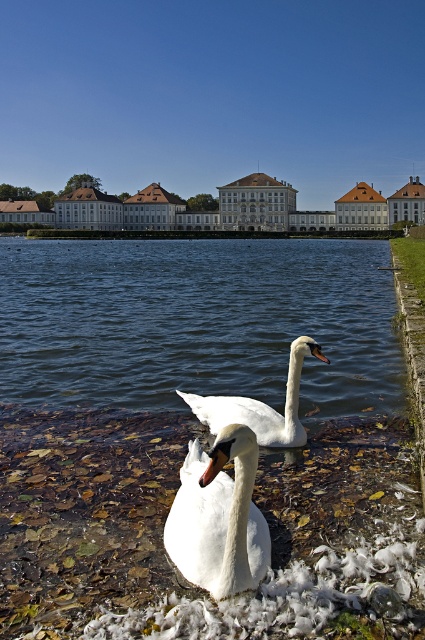
Between point (190, 509) and point (303, 436), which one is positioned in front?

Positioned in front is point (190, 509).

Is point (252, 438) closer to viewer compared to point (232, 419)?

Yes, point (252, 438) is closer to viewer.

Who is more distant from viewer, (204, 529) or (215, 406)?

Positioned behind is point (215, 406).

At what (x,y) coordinates should I click in order to perform the action: click on white matte swan at lower center. Please return your answer as a coordinate pair (x, y). The height and width of the screenshot is (640, 425). Looking at the image, I should click on (218, 516).

Is clear water at center smaller than white matte swan at lower center?

No, clear water at center is not smaller than white matte swan at lower center.

Who is shorter, clear water at center or white matte swan at lower center?

Standing shorter between the two is white matte swan at lower center.

This screenshot has width=425, height=640. Describe the element at coordinates (198, 321) in the screenshot. I see `clear water at center` at that location.

Find the location of a particular element. Image resolution: width=425 pixels, height=640 pixels. clear water at center is located at coordinates (198, 321).

Does clear water at center appear over white feathered swan at center?

Correct, clear water at center is located above white feathered swan at center.

What do you see at coordinates (198, 321) in the screenshot? The width and height of the screenshot is (425, 640). I see `clear water at center` at bounding box center [198, 321].

This screenshot has height=640, width=425. I want to click on clear water at center, so click(198, 321).

Where is `clear water at center`? The width and height of the screenshot is (425, 640). clear water at center is located at coordinates (198, 321).